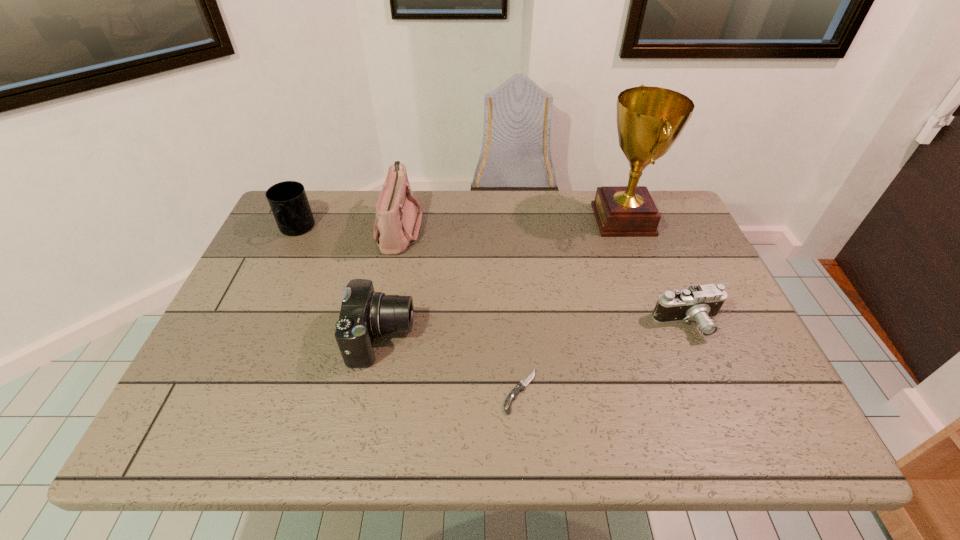
Identify the location of object positioned at the left edge. (288, 201).

The height and width of the screenshot is (540, 960). What are the coordinates of `award present at the right edge` in the screenshot? It's located at (649, 119).

Identify the location of camera that is at the right edge. This screenshot has height=540, width=960. (699, 303).

Identify the location of object that is at the far left corner. (288, 201).

The width and height of the screenshot is (960, 540). Find the location of `object located at the far right corner`. object located at the far right corner is located at coordinates (649, 119).

The height and width of the screenshot is (540, 960). Identify the location of free region at the far edge. pyautogui.click(x=543, y=200).

Find the location of a particular element. This screenshot has width=960, height=540. vacant space at the near edge of the desktop is located at coordinates point(628,424).

In the image, there is a desktop. Identify the location of free space at the left edge. This screenshot has height=540, width=960. (295, 297).

In the image, there is a desktop. At what (x,y) coordinates should I click in order to perform the action: click on vacant space at the right edge. Please return your answer as a coordinate pair (x, y). Looking at the image, I should click on (655, 247).

Locate an element on the screen. The height and width of the screenshot is (540, 960). vacant space in between the tallest object and the taller camera is located at coordinates (502, 279).